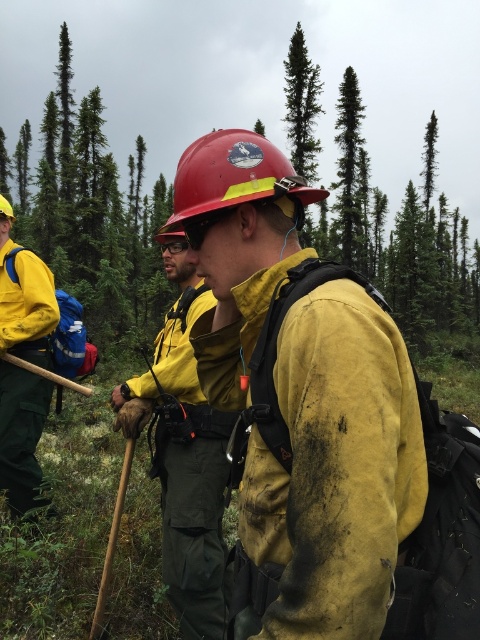
You are a safety inspector in the forest. You need to ensure that all safety equipment is within a 5 feet safety zone for quick access. You see the matte red hard hat at center and the matte yellow helmet at center. Are they within the required safety zone?

The matte red hard hat at center and the matte yellow helmet at center are 6.77 feet apart, which exceeds the 5 feet safety zone requirement. Therefore, they are not within the required safety zone.

You are a hiker who wants to take a photo of the matte yellow helmet at center and the green rough bark tree at upper center. Which object should you focus on first if you want both to be in sharp focus?

You should focus on the green rough bark tree at upper center first because it is larger and will require more precise focusing to ensure sharpness compared to the smaller matte yellow helmet at center.